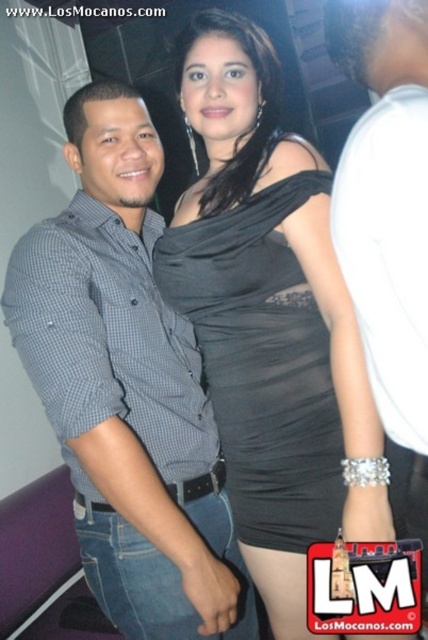
You are taking a photo of the black satin dress at center and the gray checkered shirt at left. Which one will appear larger in the photo?

The black satin dress at center will appear larger in the photo because it is closer to the viewer than the gray checkered shirt at left.

You are a photographer at a party and need to decide which clothing item to focus on for a closeup shot. The black satin dress at center and the white matte shirt at center are both in your frame. Based on their sizes, which one should you choose if you want to capture more details without zooming in?

The black satin dress at center is larger in size than the white matte shirt at center, so you should choose the black satin dress at center for the closeup to capture more details without needing to zoom in.